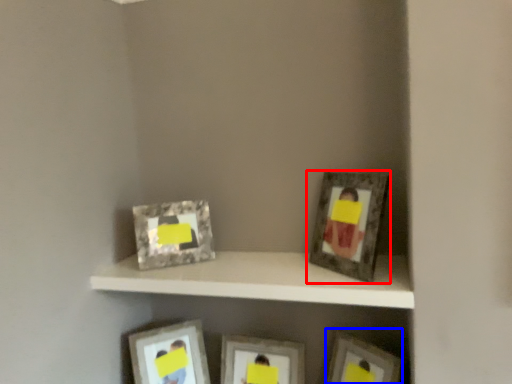
Question: Which of the following is the farthest to the observer, picture frame (highlighted by a red box) or picture frame (highlighted by a blue box)?

Choices:
 (A) picture frame
 (B) picture frame

Answer: (B)